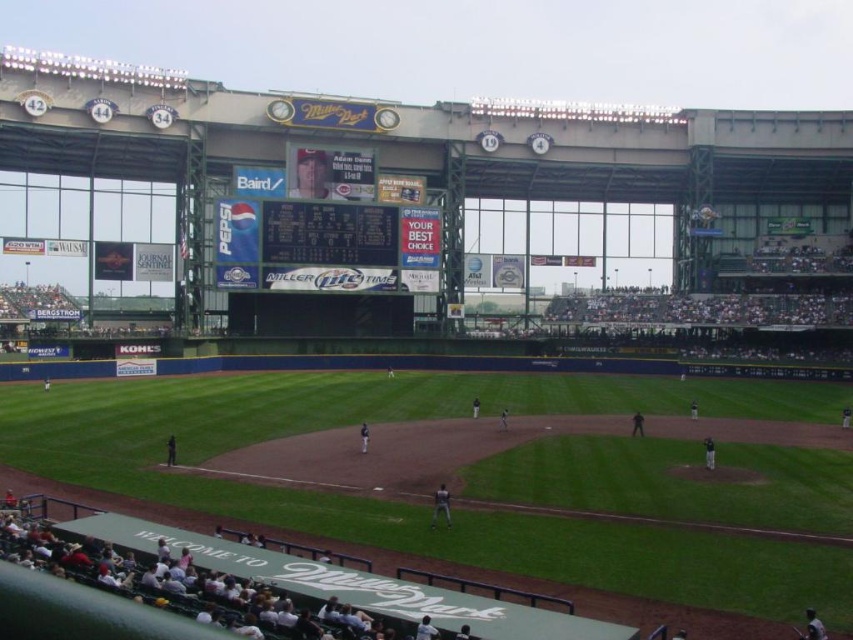
You are a photographer standing at the edge of the field. You want to take a photo that includes both the black plastic scoreboard at center and the dark gray uniform at center. Which object will appear larger in the photo?

The black plastic scoreboard at center will appear larger in the photo because it is taller than the dark gray uniform at center.

You are a photographer standing at the edge of the field. You want to take a photo that includes both the dark green fabric banner at lower center and the black plastic scoreboard at center. Which object should be placed closer to the camera to ensure both are in focus?

The dark green fabric banner at lower center is shorter than the black plastic scoreboard at center. To ensure both are in focus, the photographer should place the dark green fabric banner at lower center closer to the camera since it is shorter and needs to be within the same focal plane as the taller scoreboard.

You are a photographer standing at the edge of the field. You want to capture a photo that shows both the green grass field at center and the black plastic scoreboard at center. Which object will appear taller in the photo?

The black plastic scoreboard at center will appear taller in the photo because the green grass field at center has a lesser height compared to it.